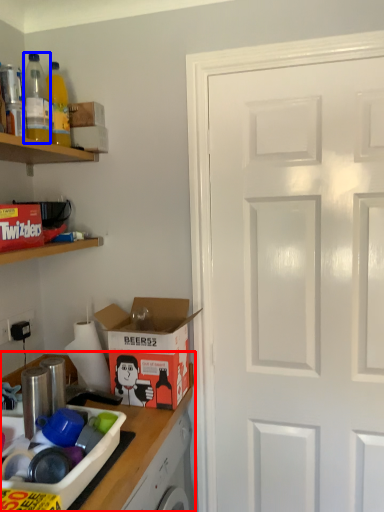
Question: Which of the following is the farthest to the observer, countertop (highlighted by a red box) or bottle (highlighted by a blue box)?

Choices:
 (A) countertop
 (B) bottle

Answer: (B)